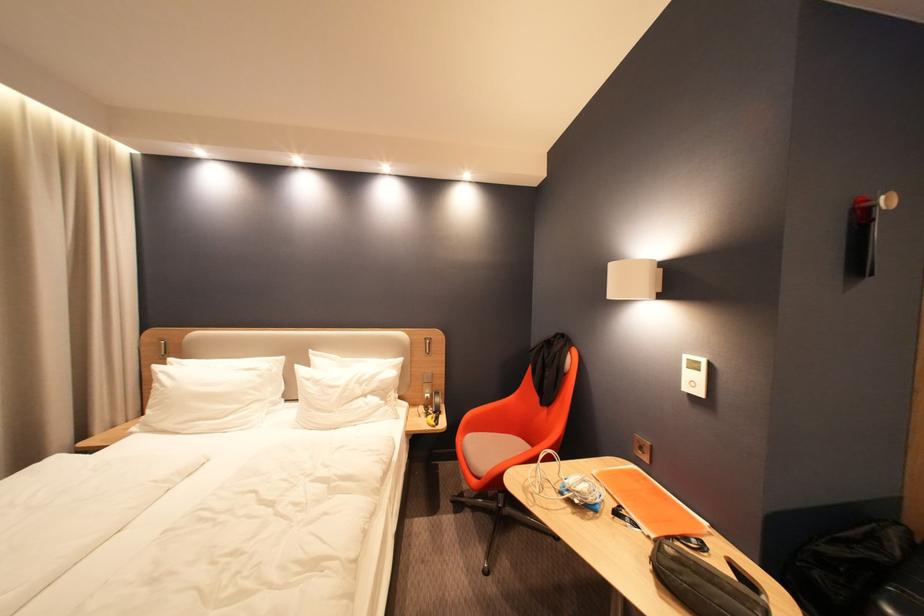
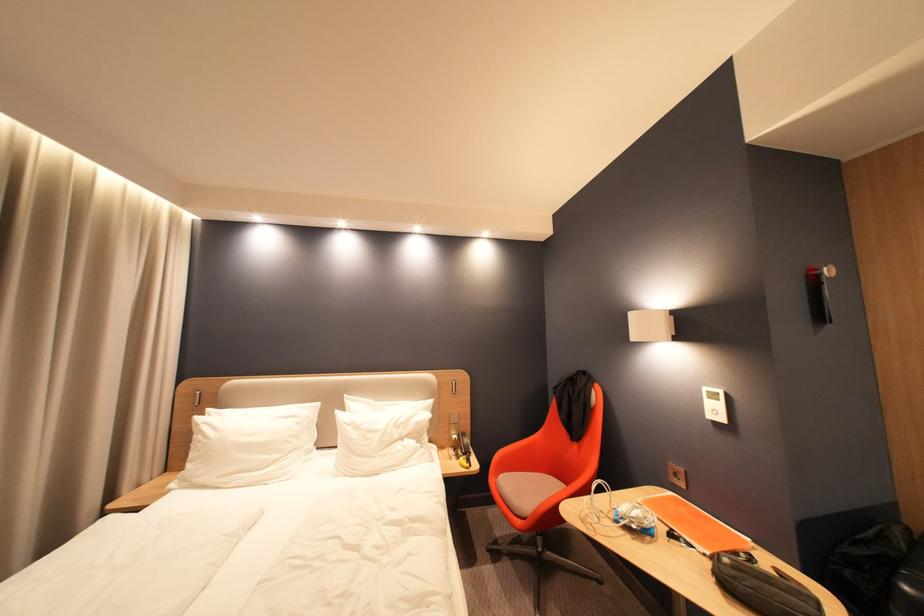
Where in the second image is the point corresponding to the point at 657,525 from the first image?

(710, 544)